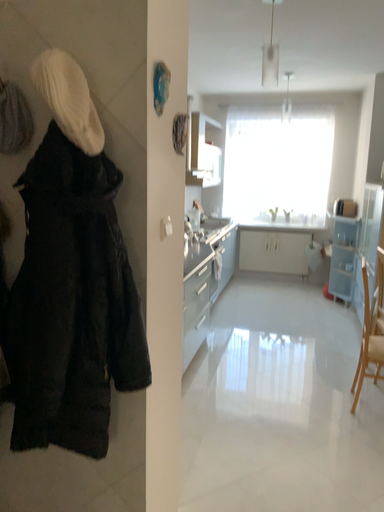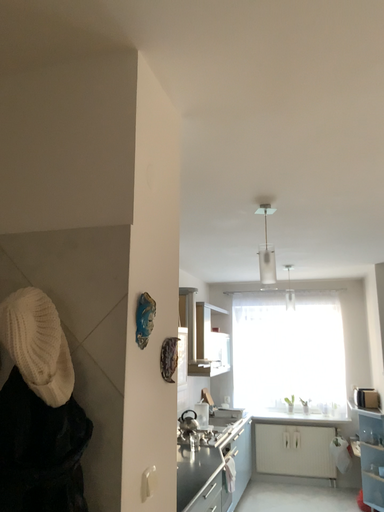
Question: Which way did the camera rotate in the video?

Choices:
 (A) rotated downward
 (B) rotated upward

Answer: (B)